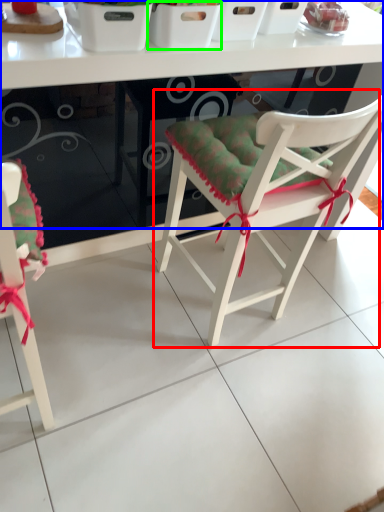
Question: Which object is positioned closest to chair (highlighted by a red box)? Select from table (highlighted by a blue box) and basket (highlighted by a green box).

Choices:
 (A) table
 (B) basket

Answer: (A)